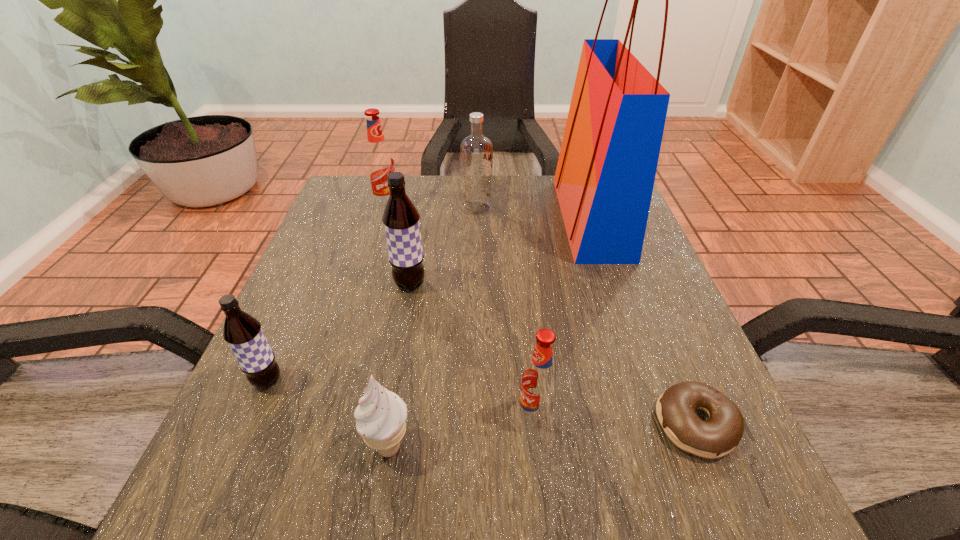
This screenshot has height=540, width=960. Find the location of `blue shopping bag`. blue shopping bag is located at coordinates (604, 180).

I want to click on the tallest object, so click(604, 180).

Identify the location of the farther red root beer. Image resolution: width=960 pixels, height=540 pixels. (379, 161).

Identify the location of the second object from left to right. The image size is (960, 540). (379, 161).

Identify the location of the third nearest root beer. Image resolution: width=960 pixels, height=540 pixels. pyautogui.click(x=401, y=221).

The image size is (960, 540). In order to click on the fourth farthest object in this screenshot , I will do `click(401, 221)`.

Find the location of `vodka`. vodka is located at coordinates (476, 151).

In order to click on the right red root beer in this screenshot , I will do `click(539, 382)`.

Locate an element on the screen. The image size is (960, 540). the rightmost root beer is located at coordinates (539, 382).

Locate an element on the screen. This screenshot has width=960, height=540. the left brown root beer is located at coordinates [243, 333].